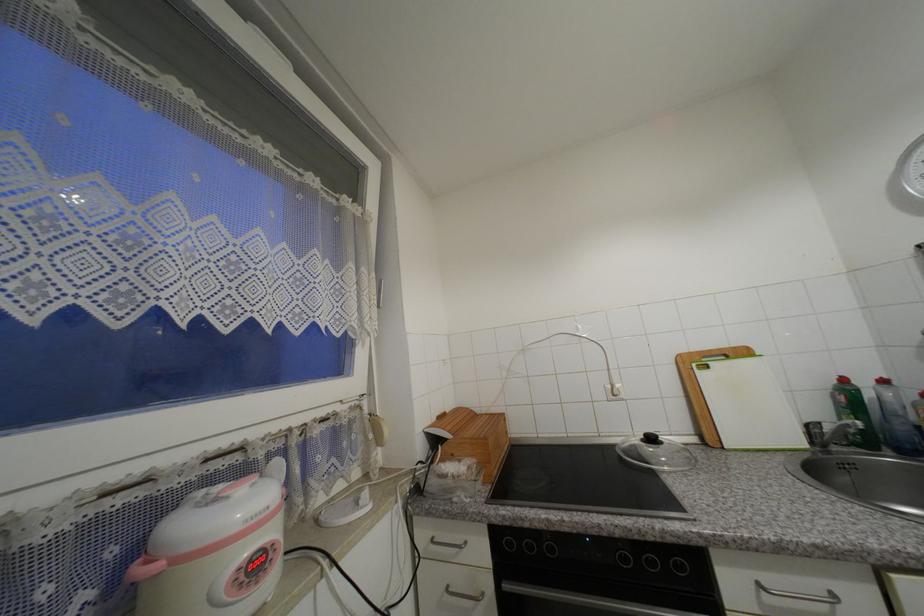
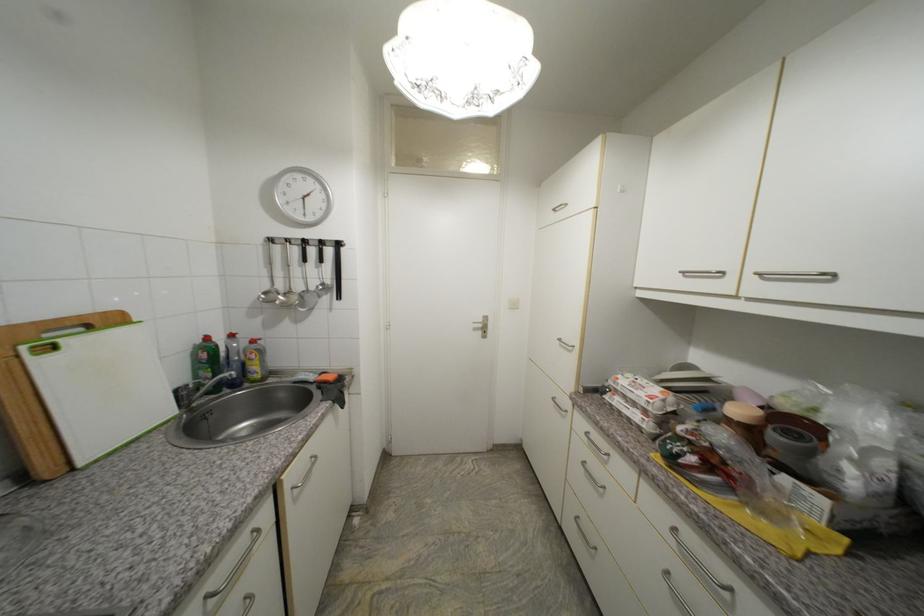
Locate, in the second image, the point that corresponds to (847,400) in the first image.

(210, 357)